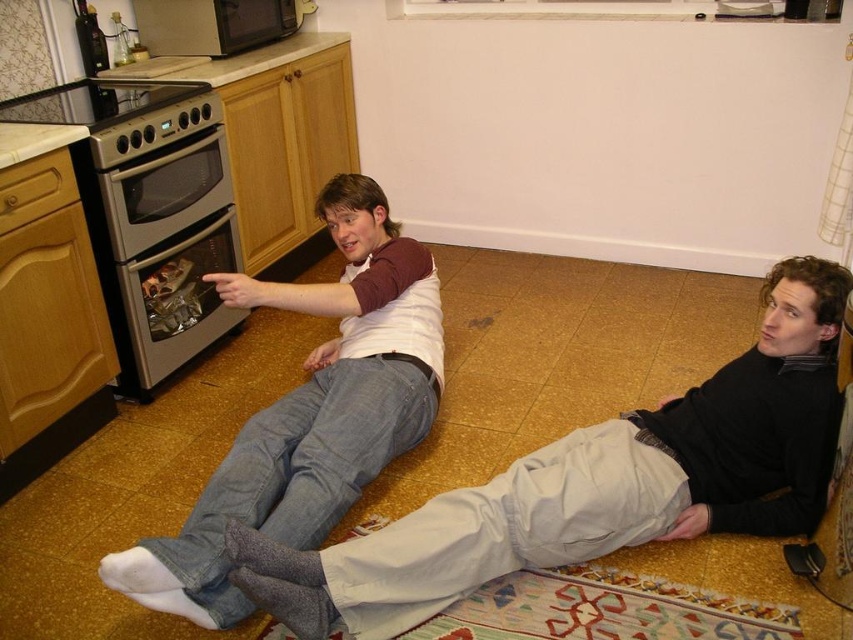
Is denim jeans at left shorter than satin silver oven at left?

Incorrect, denim jeans at left's height does not fall short of satin silver oven at left's.

Does denim jeans at left appear over satin silver oven at left?

No.

Find the location of a particular element. Image resolution: width=853 pixels, height=640 pixels. denim jeans at left is located at coordinates coord(309,412).

Does denim jeans at left come in front of black matte microwave at upper left?

Yes, denim jeans at left is closer to the viewer.

Is denim jeans at left thinner than black matte microwave at upper left?

No, denim jeans at left is not thinner than black matte microwave at upper left.

Between point (303, 397) and point (281, 4), which one is positioned in front?

Positioned in front is point (303, 397).

At what (x,y) coordinates should I click in order to perform the action: click on denim jeans at left. Please return your answer as a coordinate pair (x, y). The height and width of the screenshot is (640, 853). Looking at the image, I should click on (309, 412).

Based on the photo, is satin silver oven at left wider than black matte microwave at upper left?

Incorrect, satin silver oven at left's width does not surpass black matte microwave at upper left's.

Between satin silver oven at left and black matte microwave at upper left, which one is positioned lower?

satin silver oven at left is lower down.

Is point (189, 355) in front of point (234, 12)?

That is True.

Identify the location of satin silver oven at left. (161, 234).